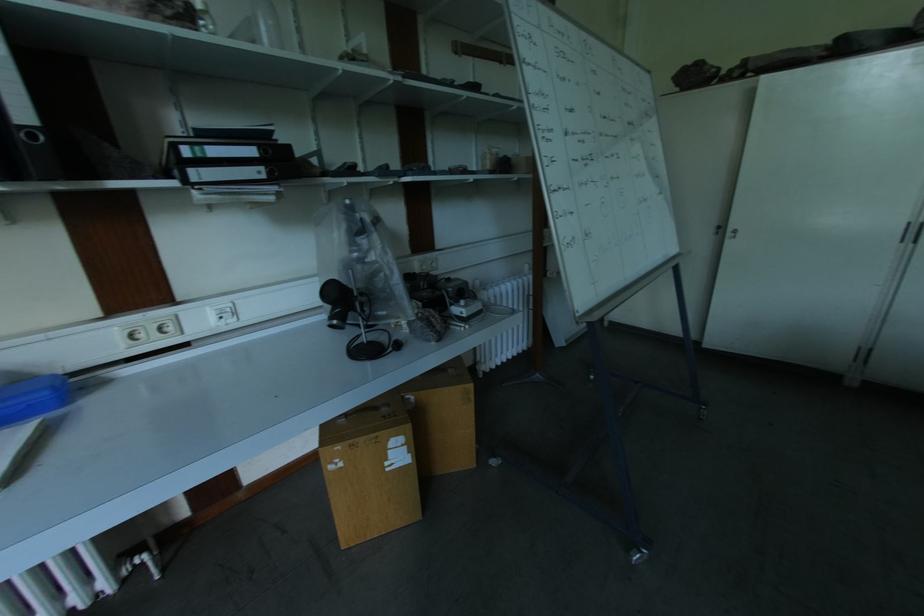
Identify the location of white wall switch. (223, 314).